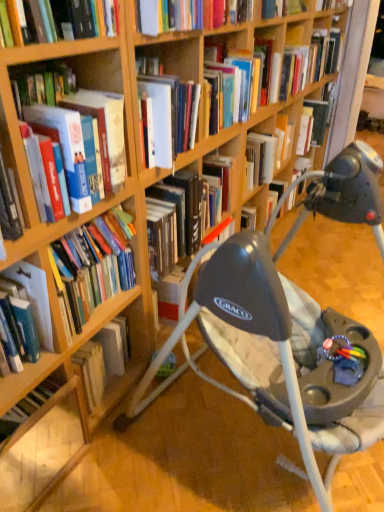
Where is `free space underneath matte black baby swing at center (from a real-world perspective)`? The width and height of the screenshot is (384, 512). free space underneath matte black baby swing at center (from a real-world perspective) is located at coordinates (250, 451).